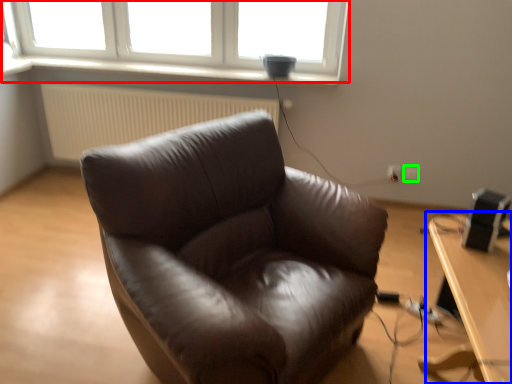
Question: Which is farther away from window (highlighted by a red box)? table (highlighted by a blue box) or electric outlet (highlighted by a green box)?

Choices:
 (A) table
 (B) electric outlet

Answer: (A)